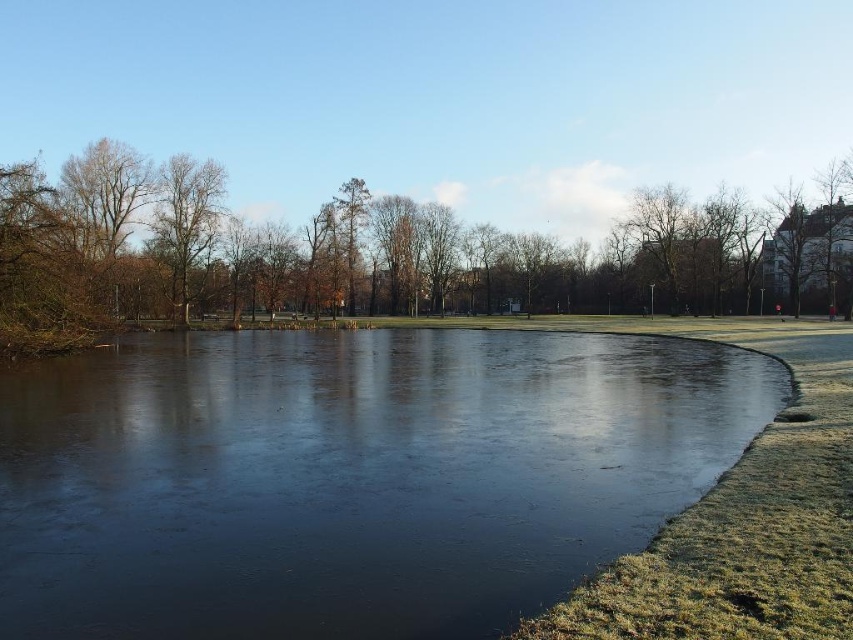
You are an ice skater planning to glide across the transparent ice at center. You notice a brown leafless tree at upper left in the distance. Based on the scene, which object would allow more light to pass through?

The transparent ice at center allows more light to pass through since it is described as thinner compared to the brown leafless tree at upper left.

You are standing on the frozen pond in the winter scene. There is a point marked at coordinates (349, 477). What is the surface you are standing on at that point?

The point at (349, 477) is on transparent ice at center, so the surface you are standing on at that point is transparent ice.